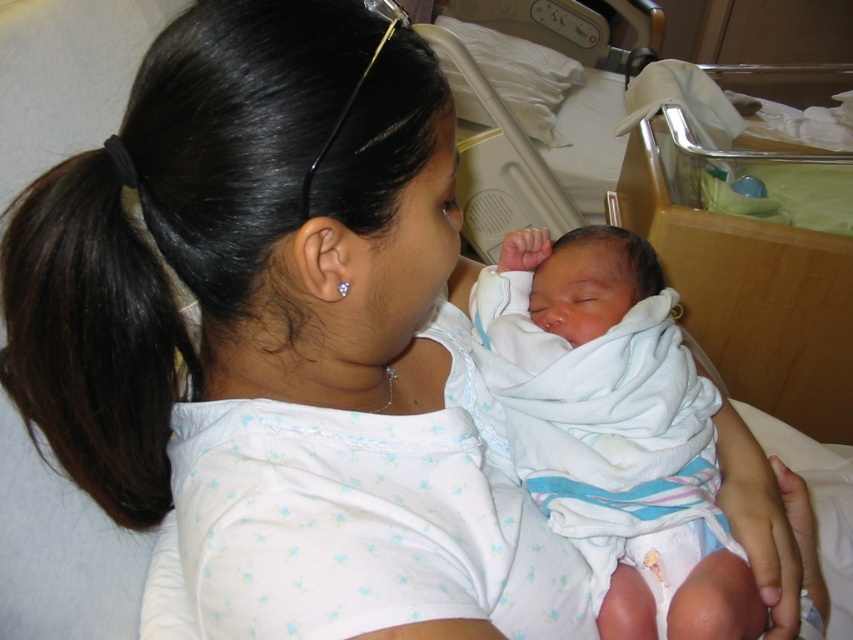
You are a nurse in a hospital. You need to check the baby in the image. Which direction should you move to reach the white soft swaddled newborn at center from the dark brown hair at upper left?

The white soft swaddled newborn at center is to the right of the dark brown hair at upper left, so you should move to the right to reach the white soft swaddled newborn at center.

You are a nurse in the hospital room. You need to place a small medical kit between the white soft swaddled newborn at center and the dark brown hair at upper left. Can you fit it there?

The white soft swaddled newborn at center is wider than the dark brown hair at upper left, so there might not be enough space to fit the medical kit between them.

You are a nurse checking the hospital room layout. You see the white soft swaddled newborn at center and the dark brown hair at upper left. Which object takes up more space in the image?

The white soft swaddled newborn at center is bigger than the dark brown hair at upper left, so it takes up more space in the image.